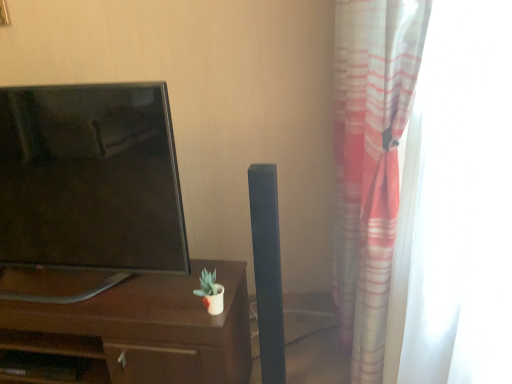
Question: From the image's perspective, is translucent fabric curtain at right located above or below brown wood desk at center?

Choices:
 (A) above
 (B) below

Answer: (A)

Question: Considering the relative positions of translucent fabric curtain at right and brown wood desk at center in the image provided, is translucent fabric curtain at right to the left or to the right of brown wood desk at center?

Choices:
 (A) left
 (B) right

Answer: (B)

Question: Estimate the real-world distances between objects in this image. Which object is farther from the matte black tv at left?

Choices:
 (A) brown wood desk at center
 (B) translucent fabric curtain at right

Answer: (B)

Question: Which object is the closest to the brown wood desk at center?

Choices:
 (A) matte black tv at left
 (B) translucent fabric curtain at right

Answer: (A)